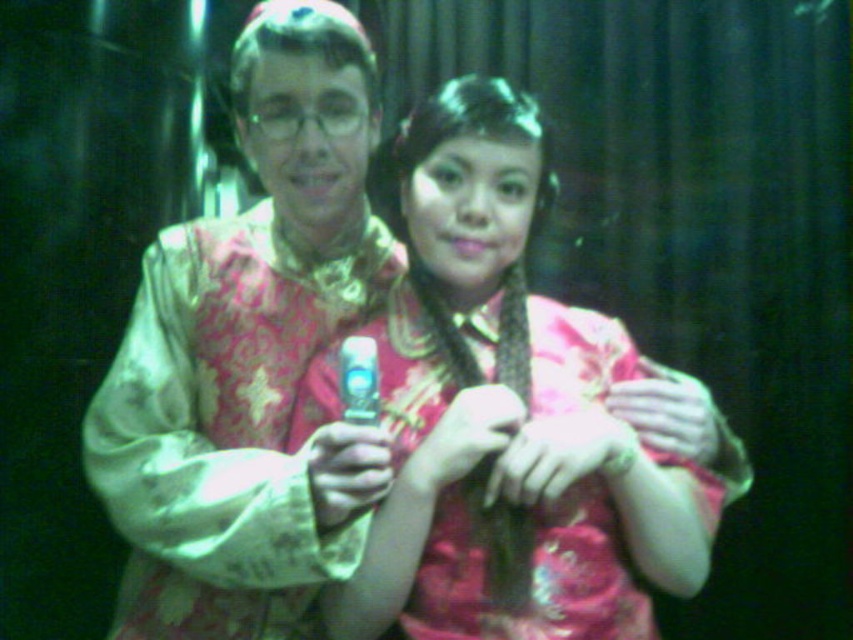
Question: Does pink satin dress at center come behind shiny metallic phone at center?

Choices:
 (A) no
 (B) yes

Answer: (B)

Question: Does pink satin dress at center come behind shiny metallic phone at center?

Choices:
 (A) no
 (B) yes

Answer: (B)

Question: Is pink satin dress at center below shiny metallic phone at center?

Choices:
 (A) yes
 (B) no

Answer: (A)

Question: Which object is farther from the camera taking this photo?

Choices:
 (A) shiny metallic phone at center
 (B) pink satin dress at center

Answer: (B)